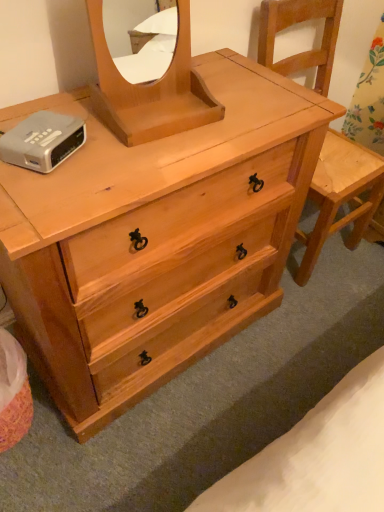
Where is `natural wood dresser at center`? The image size is (384, 512). natural wood dresser at center is located at coordinates (155, 238).

Looking at their sizes, would you say natural wood dresser at center is wider or thinner than silver metallic alarm clock at upper left?

In the image, natural wood dresser at center appears to be wider than silver metallic alarm clock at upper left.

Looking at this image, considering the positions of objects natural wood dresser at center and silver metallic alarm clock at upper left in the image provided, who is more to the right, natural wood dresser at center or silver metallic alarm clock at upper left?

Positioned to the right is natural wood dresser at center.

The height and width of the screenshot is (512, 384). Identify the location of hardware behind the natural wood dresser at center. (42, 141).

Considering the points (135, 262) and (67, 138), which point is behind, point (135, 262) or point (67, 138)?

Positioned behind is point (135, 262).

From a real-world perspective, is natural wood mirror at center positioned over silver metallic alarm clock at upper left based on gravity?

Indeed, from a real-world perspective, natural wood mirror at center stands above silver metallic alarm clock at upper left.

Measure the distance between natural wood mirror at center and silver metallic alarm clock at upper left.

natural wood mirror at center and silver metallic alarm clock at upper left are 7.75 inches apart from each other.

Can we say natural wood mirror at center lies outside silver metallic alarm clock at upper left?

Yes, natural wood mirror at center is located beyond the bounds of silver metallic alarm clock at upper left.

From the image's perspective, which is below, natural wood mirror at center or silver metallic alarm clock at upper left?

From the image's view, silver metallic alarm clock at upper left is below.

Which is nearer, (x=278, y=68) or (x=41, y=143)?

Point (x=278, y=68).

Locate an element on the screen. hardware lying in front of the natural wood chair at right is located at coordinates (42, 141).

Between natural wood chair at right and silver metallic alarm clock at upper left, which one has larger size?

natural wood chair at right.

Is natural wood chair at right further to the viewer compared to silver metallic alarm clock at upper left?

Yes, it is behind silver metallic alarm clock at upper left.

Is natural wood chair at right facing towards natural wood dresser at center?

No, natural wood chair at right is not facing towards natural wood dresser at center.

Does natural wood chair at right have a greater height compared to natural wood dresser at center?

Indeed, natural wood chair at right has a greater height compared to natural wood dresser at center.

Which of these two, natural wood chair at right or natural wood dresser at center, is smaller?

Smaller between the two is natural wood chair at right.

Measure the distance from natural wood chair at right to natural wood mirror at center.

The distance of natural wood chair at right from natural wood mirror at center is 64.75 centimeters.

Is the surface of natural wood chair at right in direct contact with natural wood mirror at center?

No, natural wood chair at right is not making contact with natural wood mirror at center.

In the image, is natural wood chair at right on the left side or the right side of natural wood mirror at center?

natural wood chair at right is to the right of natural wood mirror at center.

Is point (267, 37) positioned after point (151, 114)?

Yes.

Measure the distance between silver metallic alarm clock at upper left and natural wood chair at right.

silver metallic alarm clock at upper left is 38.56 inches away from natural wood chair at right.

Can we say silver metallic alarm clock at upper left lies outside natural wood chair at right?

silver metallic alarm clock at upper left is positioned outside natural wood chair at right.

From the image's perspective, does silver metallic alarm clock at upper left appear lower than natural wood chair at right?

Indeed, from the image's perspective, silver metallic alarm clock at upper left is shown beneath natural wood chair at right.

Is silver metallic alarm clock at upper left at the left side of natural wood chair at right?

Yes, silver metallic alarm clock at upper left is to the left of natural wood chair at right.

Looking at this image, is silver metallic alarm clock at upper left inside or outside of natural wood dresser at center?

silver metallic alarm clock at upper left can be found inside natural wood dresser at center.

Who is taller, silver metallic alarm clock at upper left or natural wood dresser at center?

natural wood dresser at center is taller.

Is silver metallic alarm clock at upper left not near natural wood dresser at center?

No.

From a real-world perspective, is silver metallic alarm clock at upper left physically above natural wood dresser at center?

Yes.

At what (x,y) coordinates should I click in order to perform the action: click on hardware that appears above the natural wood dresser at center (from the image's perspective). Please return your answer as a coordinate pair (x, y). Image resolution: width=384 pixels, height=512 pixels. Looking at the image, I should click on (42, 141).

Identify the location of mirror that is above the silver metallic alarm clock at upper left (from a real-world perspective). The image size is (384, 512). (151, 90).

Estimate the real-world distances between objects in this image. Which object is closer to silver metallic alarm clock at upper left, natural wood chair at right or natural wood mirror at center?

natural wood mirror at center lies closer to silver metallic alarm clock at upper left than the other object.

Estimate the real-world distances between objects in this image. Which object is closer to natural wood chair at right, silver metallic alarm clock at upper left or natural wood mirror at center?

natural wood mirror at center.

When comparing their distances from natural wood mirror at center, does silver metallic alarm clock at upper left or natural wood dresser at center seem closer?

Among the two, silver metallic alarm clock at upper left is located nearer to natural wood mirror at center.

Based on their spatial positions, is silver metallic alarm clock at upper left or natural wood dresser at center further from natural wood chair at right?

silver metallic alarm clock at upper left is positioned further to the anchor natural wood chair at right.

Estimate the real-world distances between objects in this image. Which object is further from natural wood dresser at center, natural wood mirror at center or natural wood chair at right?

natural wood chair at right is further to natural wood dresser at center.

Considering their positions, is natural wood chair at right positioned closer to silver metallic alarm clock at upper left than natural wood dresser at center?

natural wood dresser at center is closer to silver metallic alarm clock at upper left.

When comparing their distances from natural wood dresser at center, does natural wood chair at right or silver metallic alarm clock at upper left seem further?

natural wood chair at right.

When comparing their distances from natural wood dresser at center, does natural wood chair at right or natural wood mirror at center seem further?

Based on the image, natural wood chair at right appears to be further to natural wood dresser at center.

The width and height of the screenshot is (384, 512). What are the coordinates of `chest of drawers between silver metallic alarm clock at upper left and natural wood chair at right in the horizontal direction` in the screenshot? It's located at (155, 238).

Where is `hardware between natural wood mirror at center and natural wood dresser at center in the up-down direction`? This screenshot has height=512, width=384. hardware between natural wood mirror at center and natural wood dresser at center in the up-down direction is located at coordinates [x=42, y=141].

What are the coordinates of `mirror between silver metallic alarm clock at upper left and natural wood chair at right` in the screenshot? It's located at (151, 90).

You are a GUI agent. You are given a task and a screenshot of the screen. Output one action in this format:
    pyautogui.click(x=<x>, y=<y>)
    Task: Click on the mirror between natural wood dresser at center and natural wood chair at right in the horizontal direction
    
    Given the screenshot: What is the action you would take?
    pos(151,90)